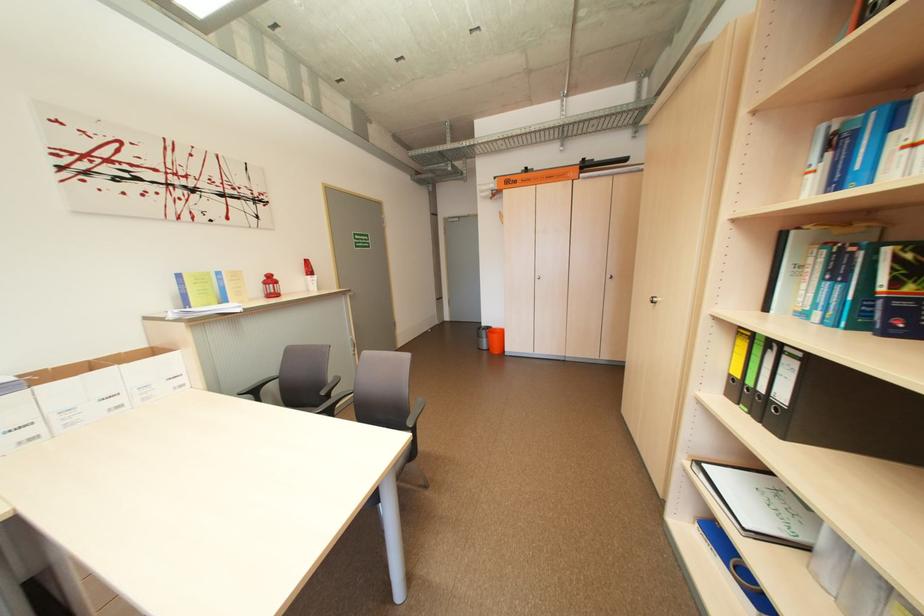
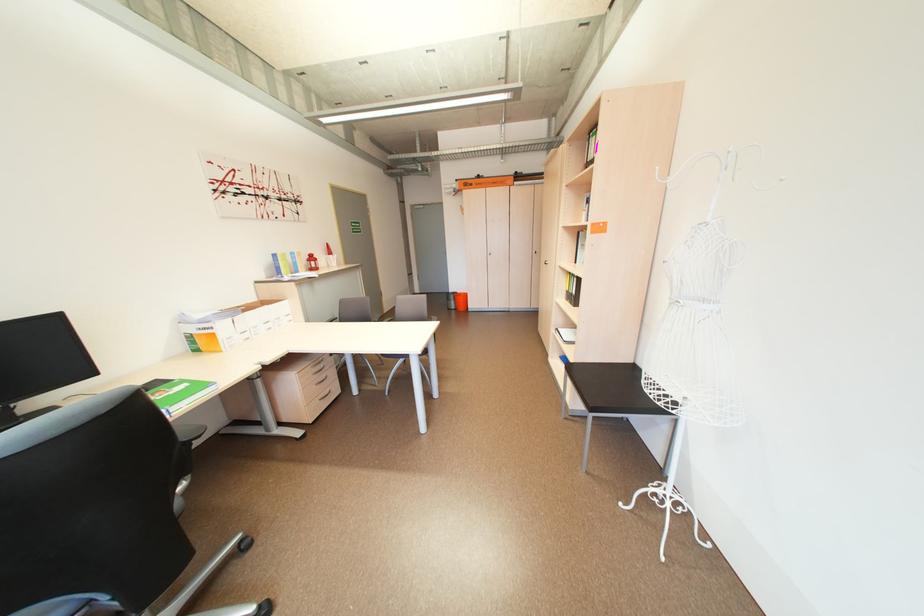
Question: I am providing you with two images of the same scene from different viewpoints. Which of the following objects are not visible in image2?

Choices:
 (A) white faucet handle
 (B) chair sitting surface
 (C) gray door handle
 (D) gray chair sitting surface

Answer: (D)